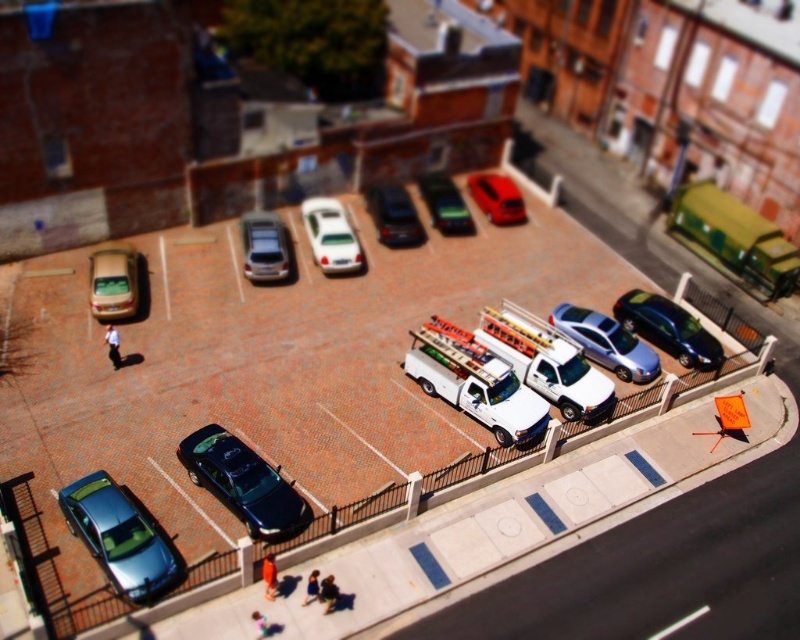
You are a delivery person trying to park a 1.6 meters tall delivery box. You see a shiny black car at center and a satin black sedan at center. Which car can you park the delivery box next to without it being taller than the car?

The shiny black car at center has a greater height compared to the satin black sedan at center, so the delivery box can be parked next to the shiny black car at center since it is taller than the delivery box.